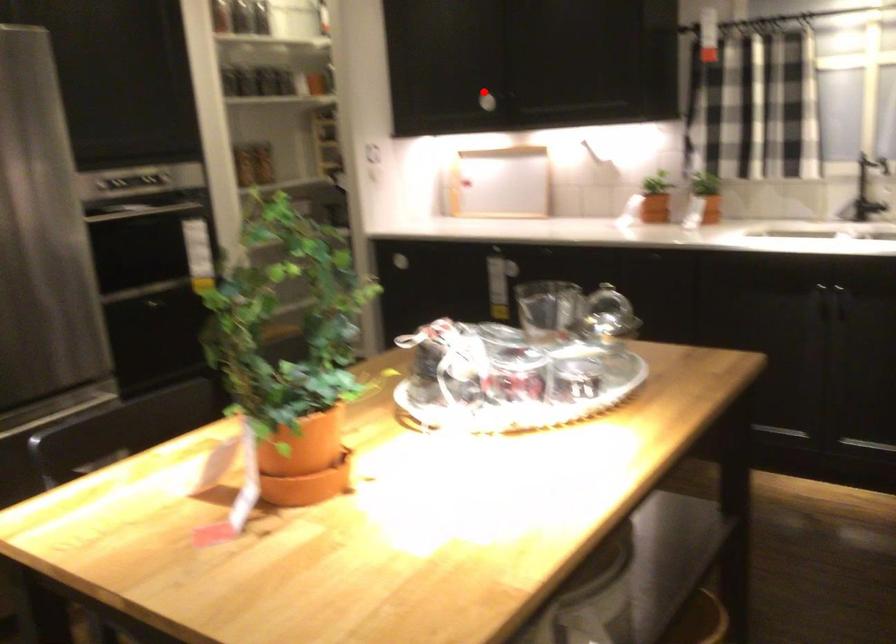
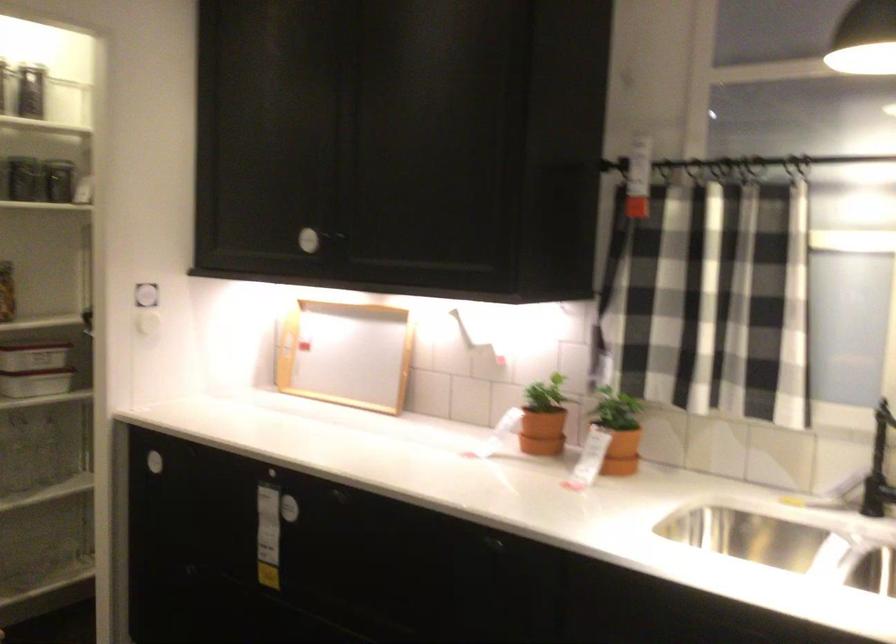
Question: I am providing you with two images of the same scene from different viewpoints. In image1, a red point is highlighted. Considering the same 3D point in image2, which of the following is correct?

Choices:
 (A) It is closer
 (B) It is farther

Answer: (A)